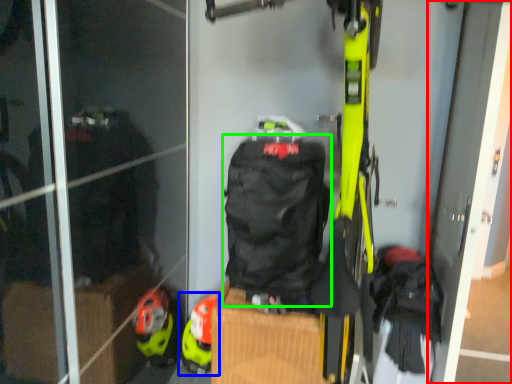
Question: Which is farther away from screen door (highlighted by a red box)? footwear (highlighted by a blue box) or backpack (highlighted by a green box)?

Choices:
 (A) footwear
 (B) backpack

Answer: (A)